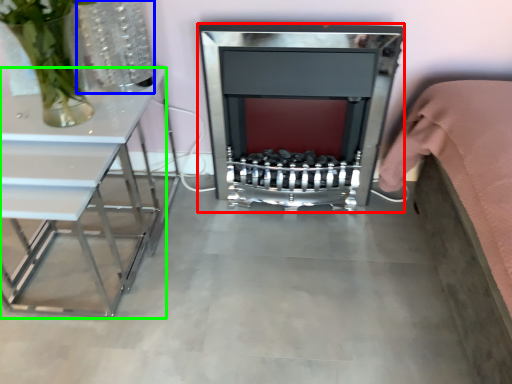
Question: Considering the real-world distances, which object is farthest from fireplace (highlighted by a red box)? vase (highlighted by a blue box) or table (highlighted by a green box)?

Choices:
 (A) vase
 (B) table

Answer: (B)